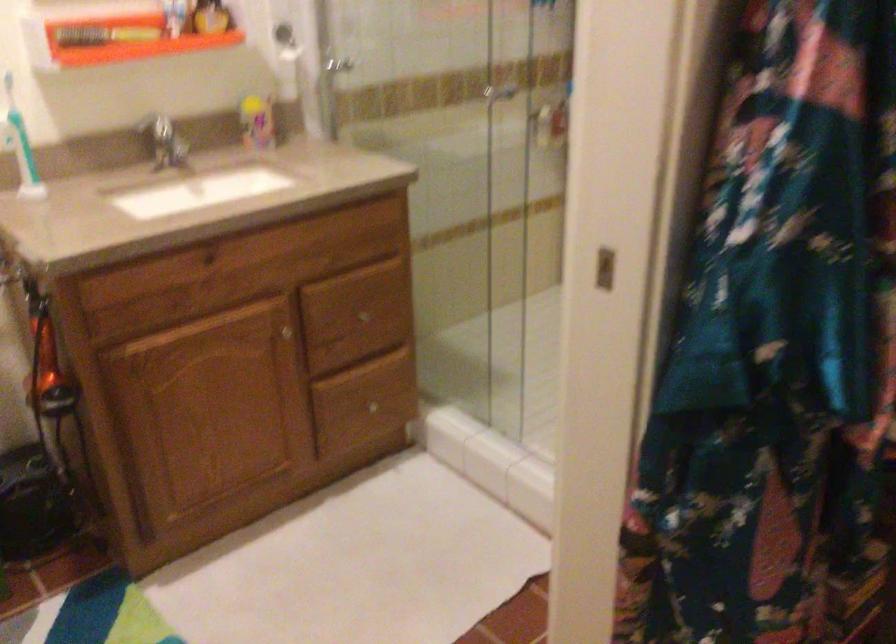
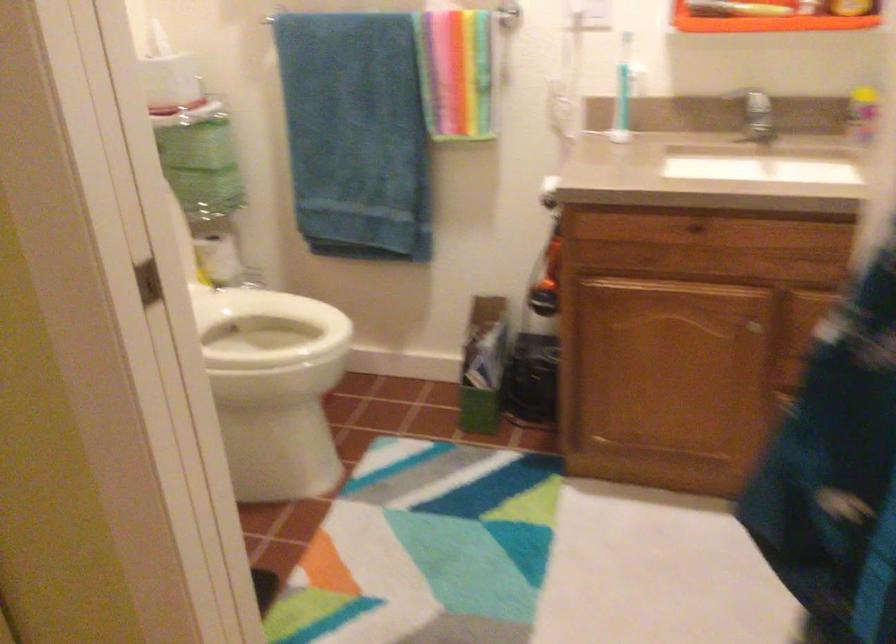
Find the pixel in the second image that matches (x=195, y=270) in the first image.

(692, 229)